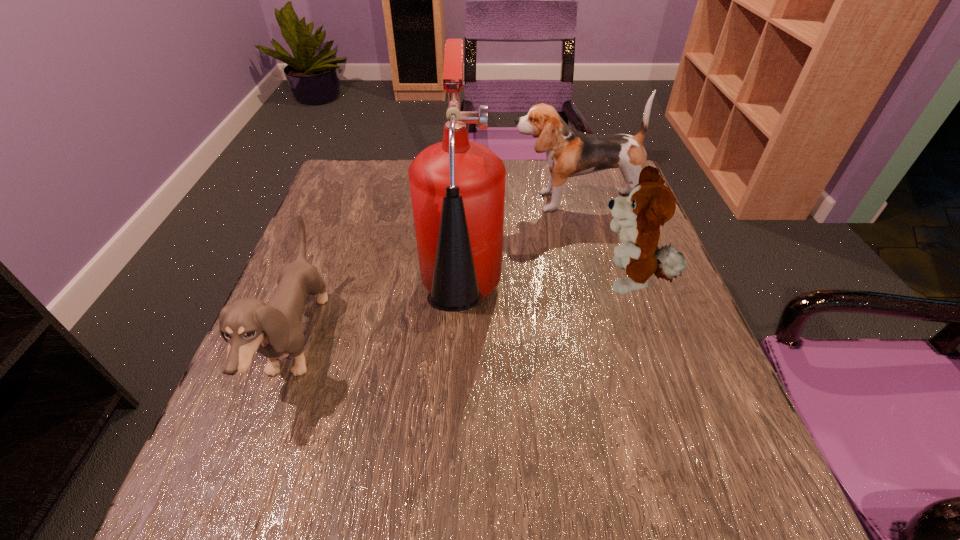
What are the coordinates of `vacant region at the right edge of the desktop` in the screenshot? It's located at (702, 401).

Identify the location of vacant region between the second object from left to right and the leftmost puppy. (379, 325).

The height and width of the screenshot is (540, 960). Find the location of `empty location between the tallest puppy and the second object from left to right`. empty location between the tallest puppy and the second object from left to right is located at coordinates (517, 254).

This screenshot has width=960, height=540. What are the coordinates of `free space that is in between the second tallest puppy and the shortest object` in the screenshot? It's located at (464, 312).

Locate an element on the screen. empty location between the second shortest object and the leftmost puppy is located at coordinates (464, 312).

The height and width of the screenshot is (540, 960). I want to click on blank region between the leftmost puppy and the third tallest object, so click(464, 312).

You are a GUI agent. You are given a task and a screenshot of the screen. Output one action in this format:
    pyautogui.click(x=<x>, y=<y>)
    Task: Click on the unoccupied area between the third shortest object and the second shortest puppy
    
    Given the screenshot: What is the action you would take?
    pyautogui.click(x=602, y=242)

In order to click on free spot between the shortest object and the third object from right to left in this screenshot , I will do `click(379, 325)`.

Select which object is the second closest to the shortest object. Please provide its 2D coordinates. Your answer should be formatted as a tuple, i.e. [(x, y)], where the tuple contains the x and y coordinates of a point satisfying the conditions above.

[(570, 153)]

Locate which object ranks in proximity to the shortest object. Please provide its 2D coordinates. Your answer should be formatted as a tuple, i.e. [(x, y)], where the tuple contains the x and y coordinates of a point satisfying the conditions above.

[(457, 186)]